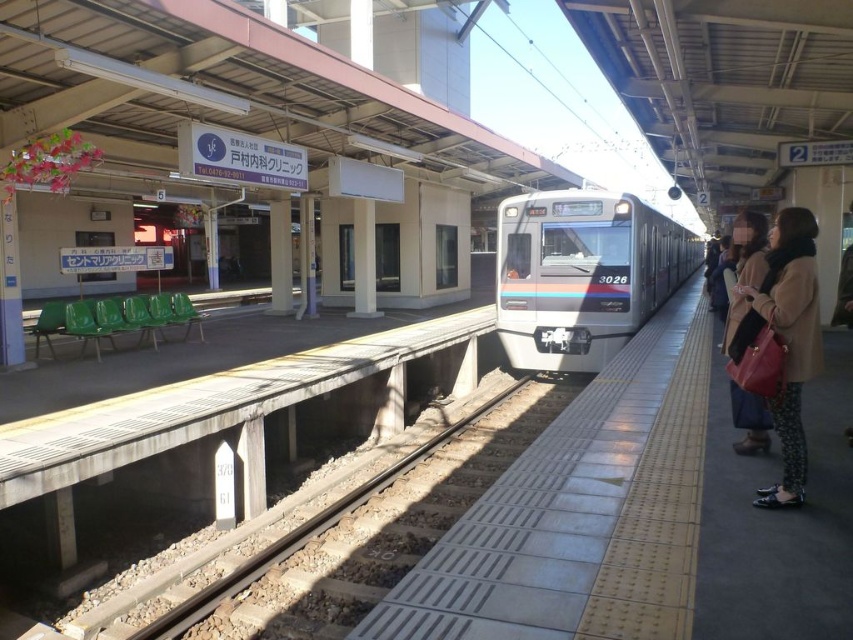
Question: Is sleek metallic train at center closer to the viewer compared to beige wool coat at right?

Choices:
 (A) yes
 (B) no

Answer: (B)

Question: From the image, what is the correct spatial relationship of beige wool coat at right in relation to brown leather handbag at right?

Choices:
 (A) right
 (B) left

Answer: (B)

Question: Which point is farther from the camera taking this photo?

Choices:
 (A) (752, 224)
 (B) (607, 266)
 (C) (788, 314)

Answer: (B)

Question: Can you confirm if sleek metallic train at center is positioned to the right of beige wool coat at right?

Choices:
 (A) no
 (B) yes

Answer: (B)

Question: Which point is farther from the camera taking this photo?

Choices:
 (A) (x=781, y=413)
 (B) (x=503, y=284)
 (C) (x=762, y=253)

Answer: (B)

Question: Which point is closer to the camera?

Choices:
 (A) (764, 406)
 (B) (793, 451)
 (C) (648, 264)

Answer: (B)